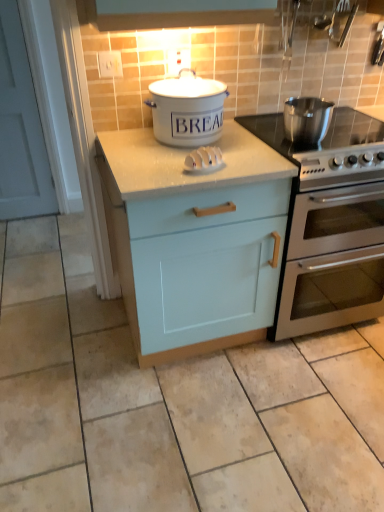
Question: Is white plastic knife block at center surrounded by stainless steel gas stove at right?

Choices:
 (A) no
 (B) yes

Answer: (A)

Question: Is stainless steel gas stove at right positioned with its back to white plastic knife block at center?

Choices:
 (A) yes
 (B) no

Answer: (B)

Question: Is stainless steel gas stove at right next to white plastic knife block at center and touching it?

Choices:
 (A) yes
 (B) no

Answer: (B)

Question: Considering the relative sizes of stainless steel gas stove at right and white plastic knife block at center in the image provided, is stainless steel gas stove at right taller than white plastic knife block at center?

Choices:
 (A) yes
 (B) no

Answer: (A)

Question: Is stainless steel gas stove at right to the left of white plastic knife block at center from the viewer's perspective?

Choices:
 (A) yes
 (B) no

Answer: (B)

Question: Is stainless steel gas stove at right bigger than white plastic knife block at center?

Choices:
 (A) no
 (B) yes

Answer: (B)

Question: From the image's perspective, would you say white plastic knife block at center is shown under white ceramic bread bin at center, acting as the 1th kitchen appliance starting from the left?

Choices:
 (A) yes
 (B) no

Answer: (A)

Question: Considering the relative sizes of white plastic knife block at center and white ceramic bread bin at center, acting as the 1th kitchen appliance starting from the left, in the image provided, is white plastic knife block at center thinner than white ceramic bread bin at center, acting as the 1th kitchen appliance starting from the left,?

Choices:
 (A) no
 (B) yes

Answer: (B)

Question: Is white plastic knife block at center outside white ceramic bread bin at center, acting as the 2th kitchen appliance starting from the right?

Choices:
 (A) no
 (B) yes

Answer: (B)

Question: Is white ceramic bread bin at center, acting as the 2th kitchen appliance starting from the right, completely or partially inside white plastic knife block at center?

Choices:
 (A) no
 (B) yes

Answer: (A)

Question: Can you confirm if white plastic knife block at center is smaller than white ceramic bread bin at center, acting as the 2th kitchen appliance starting from the right?

Choices:
 (A) no
 (B) yes

Answer: (B)

Question: Is white plastic knife block at center facing towards white ceramic bread bin at center, acting as the 2th kitchen appliance starting from the right?

Choices:
 (A) no
 (B) yes

Answer: (A)

Question: Is stainless steel oven at right to the left of white plastic knife block at center from the viewer's perspective?

Choices:
 (A) no
 (B) yes

Answer: (A)